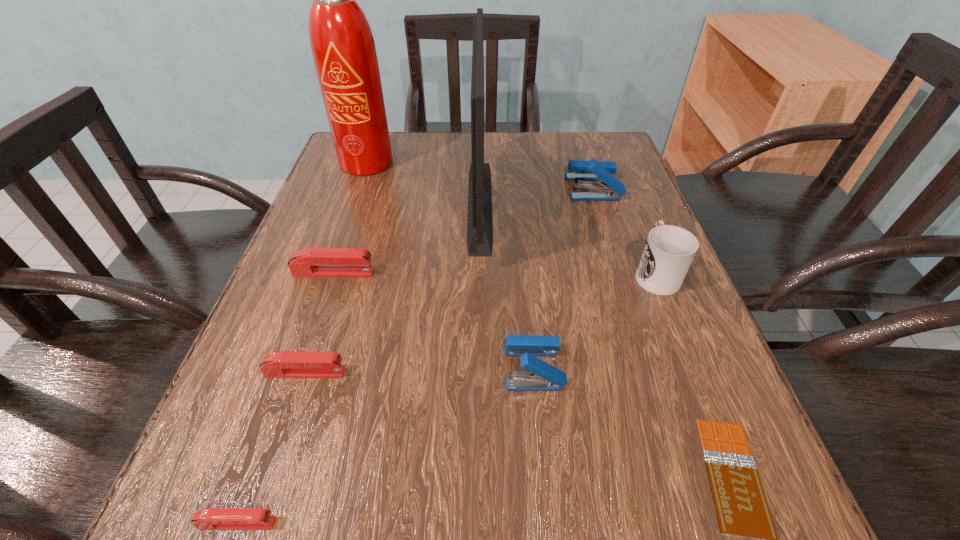
At what (x,y) coordinates should I click in order to perform the action: click on free space at the far right corner of the desktop. Please return your answer as a coordinate pair (x, y). Looking at the image, I should click on (568, 134).

This screenshot has width=960, height=540. Identify the location of free spot between the nearer blue stapler and the bigger blue stapler. tap(564, 278).

Where is `free space between the second shortest object and the third tallest stapler`? The width and height of the screenshot is (960, 540). free space between the second shortest object and the third tallest stapler is located at coordinates (285, 398).

Image resolution: width=960 pixels, height=540 pixels. What are the coordinates of `unoccupied area between the smallest red stapler and the second farthest red stapler` in the screenshot? It's located at (271, 448).

Where is `free point between the cup and the second shortest stapler`? free point between the cup and the second shortest stapler is located at coordinates (480, 322).

Where is `empty location between the monitor and the right blue stapler`? The image size is (960, 540). empty location between the monitor and the right blue stapler is located at coordinates (537, 196).

Where is `free space between the cup and the nearer blue stapler`? The image size is (960, 540). free space between the cup and the nearer blue stapler is located at coordinates (594, 320).

Identify the location of blank region between the smaller blue stapler and the farther blue stapler. Image resolution: width=960 pixels, height=540 pixels. (564, 278).

Choose which object is the third nearest neighbor to the second tallest object. Please provide its 2D coordinates. Your answer should be formatted as a tuple, i.e. [(x, y)], where the tuple contains the x and y coordinates of a point satisfying the conditions above.

[(311, 262)]

Locate an element on the screen. object that stands as the seventh closest to the nearest red stapler is located at coordinates (342, 44).